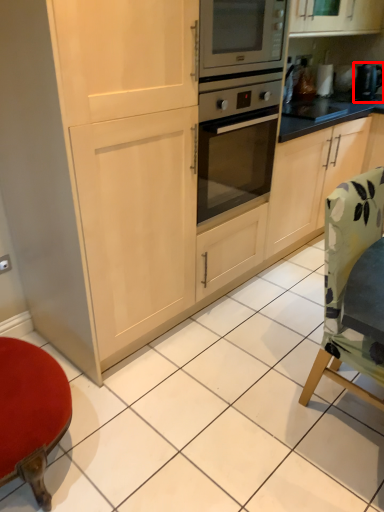
Question: In this image, where is appliance (annotated by the red box) located relative to chair?

Choices:
 (A) right
 (B) left

Answer: (A)